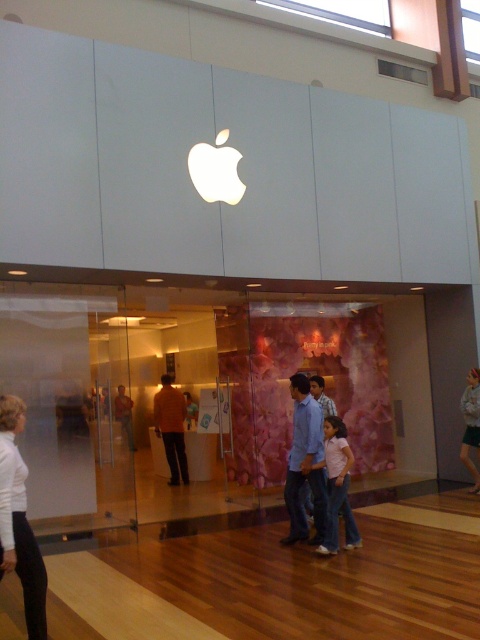
You are a customer entering the Apple store and see the white matte pants at lower left and the light blue jeans at center. Which item is positioned more to the left side of the store?

The white matte pants at lower left are positioned more to the left side of the store than the light blue jeans at center.